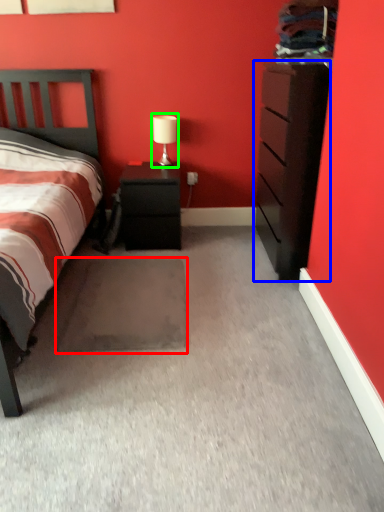
Question: Which object is the farthest from footrest (highlighted by a red box)? Choose among these: chest of drawers (highlighted by a blue box) or table lamp (highlighted by a green box).

Choices:
 (A) chest of drawers
 (B) table lamp

Answer: (B)